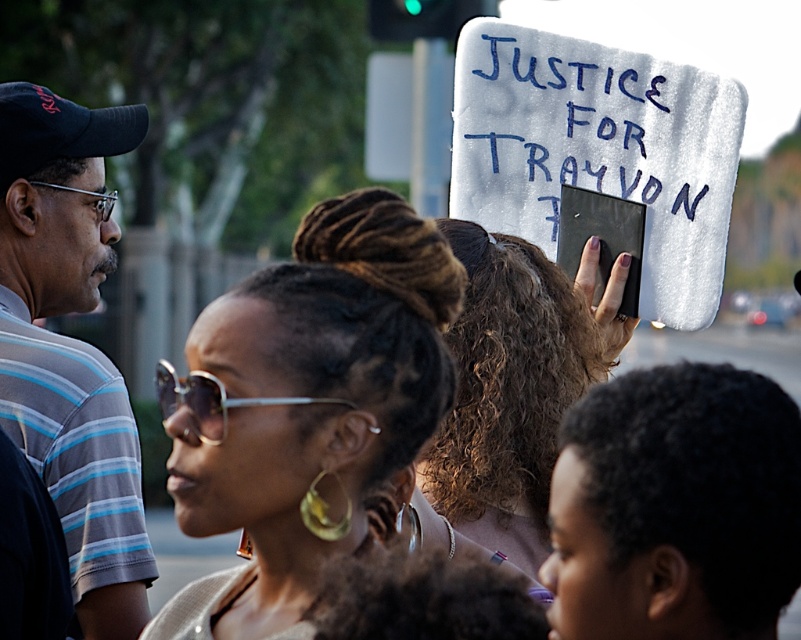
Which is behind, point (533, 433) or point (321, 400)?

Point (533, 433)

Who is more forward, (461, 529) or (208, 420)?

Positioned in front is point (208, 420).

Who is more distant from viewer, (520, 557) or (336, 401)?

The point (520, 557) is more distant.

The width and height of the screenshot is (801, 640). What are the coordinates of `curly brown hair at center` in the screenshot? It's located at (513, 388).

How distant is sunglasses at center from curly brown hair at center?

sunglasses at center is 8.74 feet from curly brown hair at center.

Which is behind, point (272, 337) or point (562, 356)?

The point (562, 356) is behind.

This screenshot has width=801, height=640. Identify the location of sunglasses at center. (292, 436).

Does sunglasses at center appear on the right side of silver metallic sunglasses at center?

Yes, sunglasses at center is to the right of silver metallic sunglasses at center.

Consider the image. Does sunglasses at center lie behind silver metallic sunglasses at center?

Yes, sunglasses at center is further from the viewer.

Between point (421, 392) and point (256, 404), which one is positioned behind?

Point (421, 392)

At what (x,y) coordinates should I click in order to perform the action: click on sunglasses at center. Please return your answer as a coordinate pair (x, y). This screenshot has width=801, height=640. Looking at the image, I should click on (292, 436).